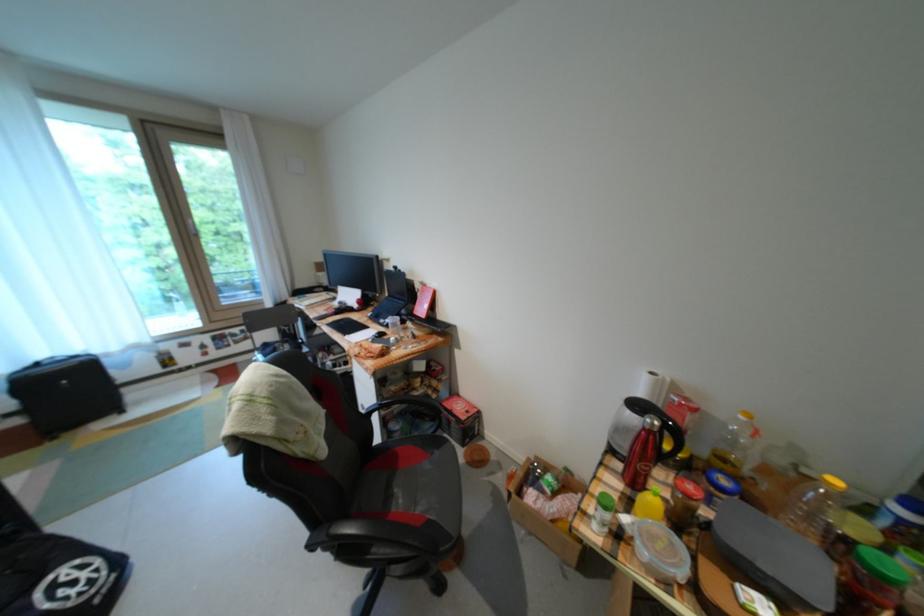
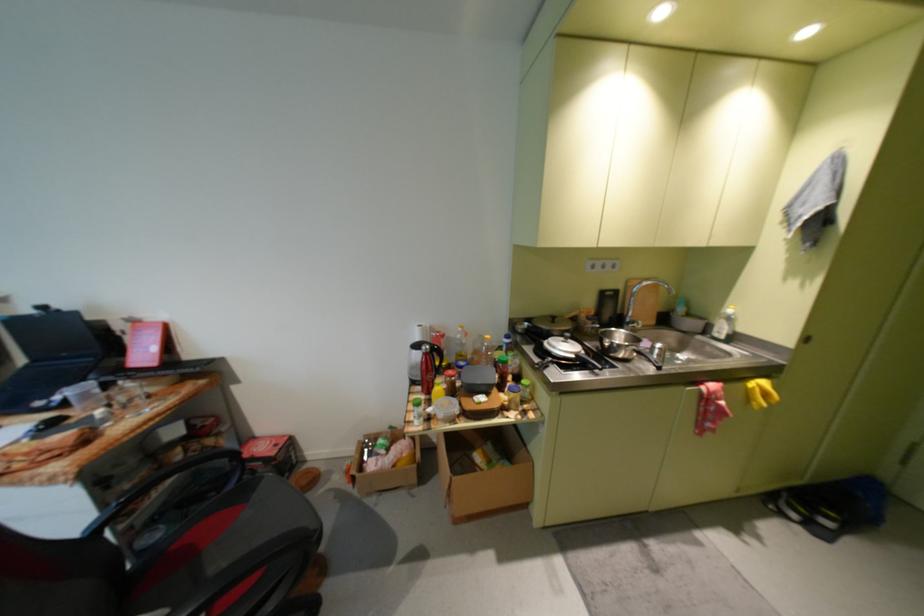
Where in the second image is the point corresponding to [634,495] from the first image?

(435, 400)